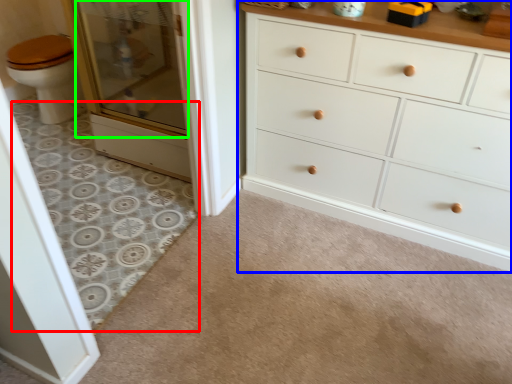
Question: Which object is positioned farthest from plain (highlighted by a red box)? Select from chest of drawers (highlighted by a blue box) and screen door (highlighted by a green box).

Choices:
 (A) chest of drawers
 (B) screen door

Answer: (A)